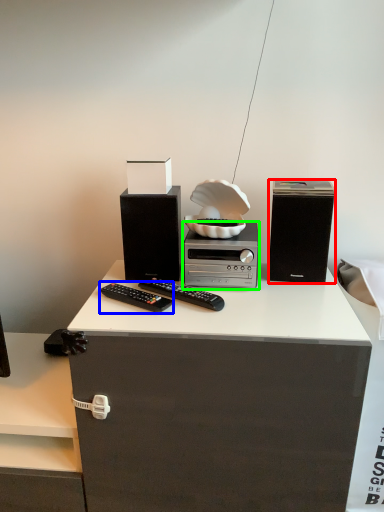
Question: Which object is positioned farthest from speaker (highlighted by a red box)? Select from remote control (highlighted by a blue box) and home appliance (highlighted by a green box).

Choices:
 (A) remote control
 (B) home appliance

Answer: (A)